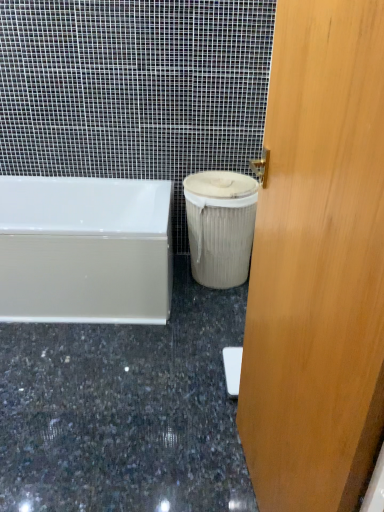
Question: From their relative heights in the image, would you say white glossy bathtub at lower left is taller or shorter than wooden door at center?

Choices:
 (A) short
 (B) tall

Answer: (A)

Question: Does point (148, 215) appear closer or farther from the camera than point (243, 437)?

Choices:
 (A) closer
 (B) farther

Answer: (B)

Question: Estimate the real-world distances between objects in this image. Which object is farther from the wooden door at center?

Choices:
 (A) beige fabric trash can at lower right
 (B) granite at lower center
 (C) white glossy bathtub at lower left

Answer: (A)

Question: Which is farther from the wooden door at center?

Choices:
 (A) white glossy bathtub at lower left
 (B) beige fabric trash can at lower right
 (C) granite at lower center

Answer: (B)